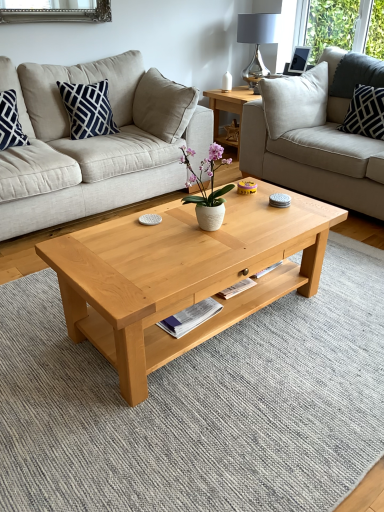
Question: Does metallic silver lamp at upper right come in front of white cotton pillow at upper right, the 1th pillow when ordered from right to left?

Choices:
 (A) yes
 (B) no

Answer: (B)

Question: Is metallic silver lamp at upper right with white cotton pillow at upper right, the 1th pillow when ordered from right to left?

Choices:
 (A) no
 (B) yes

Answer: (A)

Question: From the image's perspective, is metallic silver lamp at upper right below white cotton pillow at upper right, the 1th pillow when ordered from right to left?

Choices:
 (A) yes
 (B) no

Answer: (B)

Question: Could white cotton pillow at upper right, the 2th pillow when ordered from left to right, be considered to be inside metallic silver lamp at upper right?

Choices:
 (A) yes
 (B) no

Answer: (B)

Question: Can you confirm if metallic silver lamp at upper right is bigger than white cotton pillow at upper right, the 2th pillow when ordered from left to right?

Choices:
 (A) yes
 (B) no

Answer: (A)

Question: In the image, is beige fabric couch at center, the 1th studio couch positioned from the left, on the left side or the right side of navy blue cotton pillow at upper left, which is the first pillow in left-to-right order?

Choices:
 (A) right
 (B) left

Answer: (B)

Question: Is point (112, 79) closer or farther from the camera than point (114, 128)?

Choices:
 (A) closer
 (B) farther

Answer: (B)

Question: In the image, is beige fabric couch at center, the 1th studio couch positioned from the left, positioned in front of or behind navy blue cotton pillow at upper left, placed as the 2th pillow when sorted from right to left?

Choices:
 (A) behind
 (B) front

Answer: (B)

Question: Is beige fabric couch at center, arranged as the 2th studio couch when viewed from the right, spatially inside navy blue cotton pillow at upper left, which is the first pillow in left-to-right order, or outside of it?

Choices:
 (A) outside
 (B) inside

Answer: (A)

Question: Is light gray fabric couch at upper right, the 1th studio couch from the right, inside or outside of metallic silver lamp at upper right?

Choices:
 (A) outside
 (B) inside

Answer: (A)

Question: Considering the positions of light gray fabric couch at upper right, the 1th studio couch from the right, and metallic silver lamp at upper right in the image, is light gray fabric couch at upper right, the 1th studio couch from the right, bigger or smaller than metallic silver lamp at upper right?

Choices:
 (A) small
 (B) big

Answer: (B)

Question: Is light gray fabric couch at upper right, the 1th studio couch from the right, in front of or behind metallic silver lamp at upper right in the image?

Choices:
 (A) behind
 (B) front

Answer: (B)

Question: From the image's perspective, is light gray fabric couch at upper right, the 1th studio couch from the right, positioned above or below metallic silver lamp at upper right?

Choices:
 (A) below
 (B) above

Answer: (A)

Question: Based on their positions, is matte black picture frame at upper right located to the left or right of navy blue cotton pillow at upper left, which is the first pillow in left-to-right order?

Choices:
 (A) left
 (B) right

Answer: (B)

Question: Considering the positions of point (289, 65) and point (74, 96), is point (289, 65) closer or farther from the camera than point (74, 96)?

Choices:
 (A) closer
 (B) farther

Answer: (B)